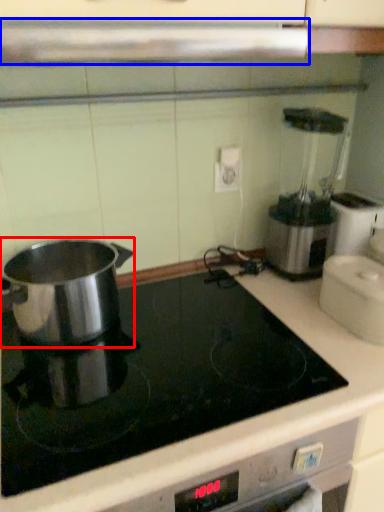
Question: Which of the following is the closest to the observer, kitchen appliance (highlighted by a red box) or exhaust hood (highlighted by a blue box)?

Choices:
 (A) kitchen appliance
 (B) exhaust hood

Answer: (B)